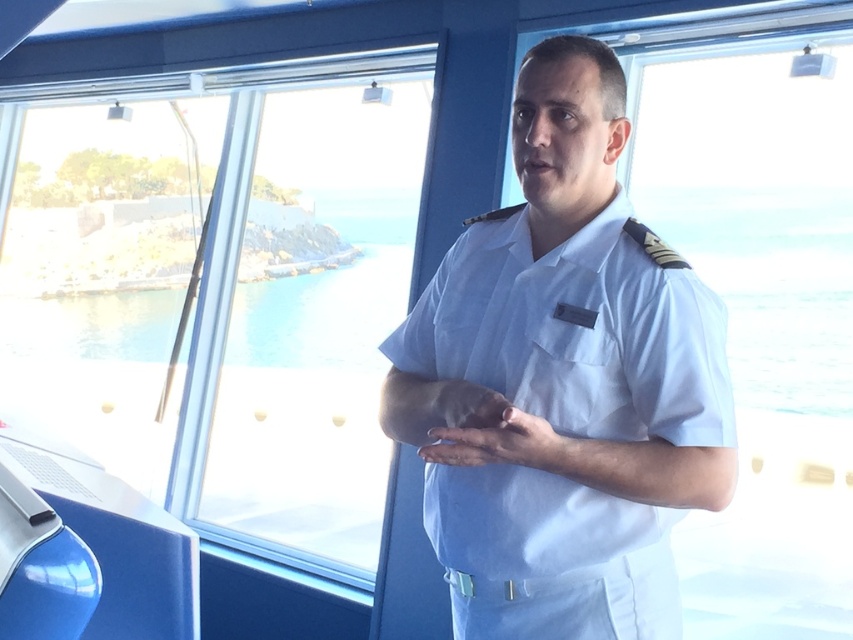
Question: Is white cotton shirt at center further to camera compared to transparent glass window at center?

Choices:
 (A) yes
 (B) no

Answer: (B)

Question: Where is white cotton shirt at center located in relation to transparent glass window at center in the image?

Choices:
 (A) above
 (B) below

Answer: (B)

Question: Observing the image, what is the correct spatial positioning of white cotton shirt at center in reference to transparent glass window at center?

Choices:
 (A) below
 (B) above

Answer: (A)

Question: Which of the following is the closest to the observer?

Choices:
 (A) (604, 339)
 (B) (335, 109)

Answer: (A)

Question: Which point is farther to the camera?

Choices:
 (A) transparent glass window at center
 (B) white cotton shirt at center

Answer: (A)